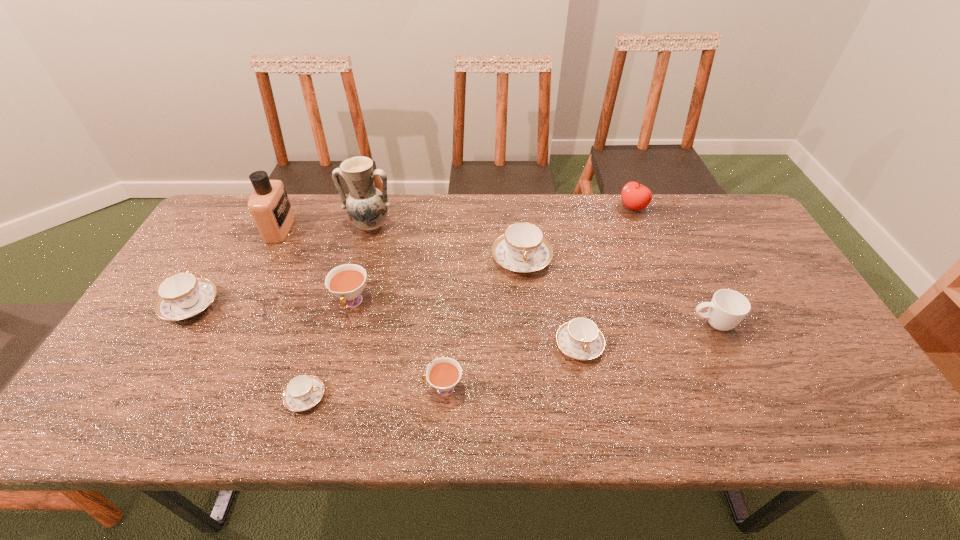
Identify the location of free point between the farthest teacup and the second object from left to right. The width and height of the screenshot is (960, 540). tap(400, 244).

I want to click on free space between the farthest teacup and the cup, so click(x=617, y=291).

This screenshot has width=960, height=540. Find the location of `free space between the beige perfume and the shortest object`. free space between the beige perfume and the shortest object is located at coordinates (293, 313).

Identify the location of empty space that is in between the bigger white teacup and the smaller white teacup. (397, 346).

Locate which object is the seventh closest to the beige perfume. Please provide its 2D coordinates. Your answer should be formatted as a tuple, i.e. [(x, y)], where the tuple contains the x and y coordinates of a point satisfying the conditions above.

[(580, 338)]

Locate an element on the screen. object that ranks as the seventh closest to the cup is located at coordinates (303, 392).

Locate an element on the screen. The image size is (960, 540). the fifth closest teacup to the bigger white teacup is located at coordinates (580, 338).

Locate an element on the screen. the sixth closest teacup to the beige perfume is located at coordinates (580, 338).

Locate an element on the screen. The height and width of the screenshot is (540, 960). blue teacup that is the nearest to the smallest blue teacup is located at coordinates (181, 296).

Identify which blue teacup is the closest to the nearer white teacup. Please provide its 2D coordinates. Your answer should be formatted as a tuple, i.e. [(x, y)], where the tuple contains the x and y coordinates of a point satisfying the conditions above.

[(303, 392)]